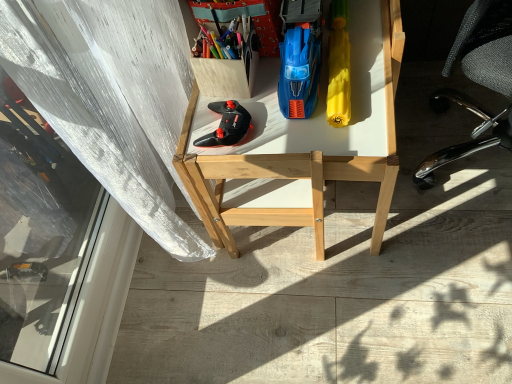
In order to click on vacant area that is in front of wooden box at upper left, which appears as the third stationery when viewed from the right in this screenshot , I will do `click(266, 126)`.